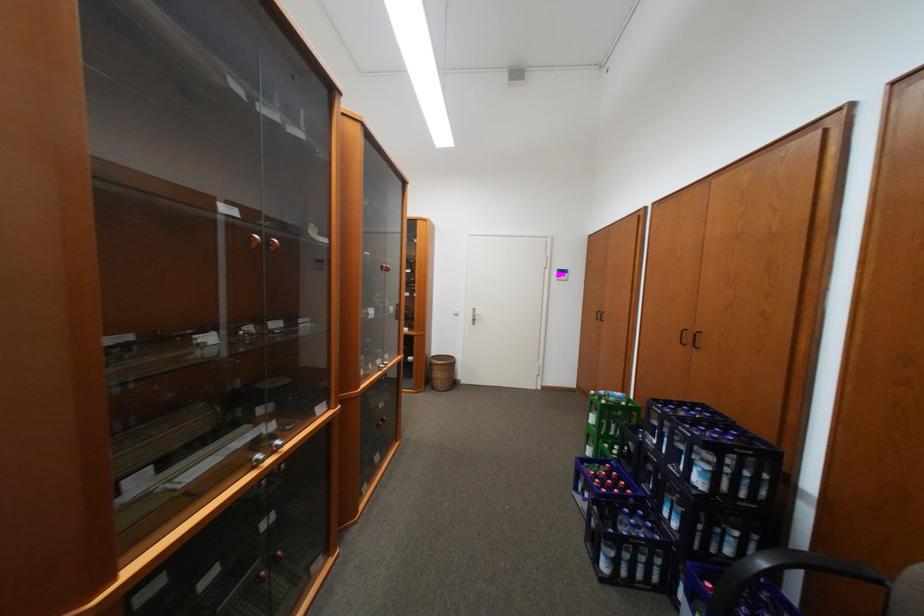
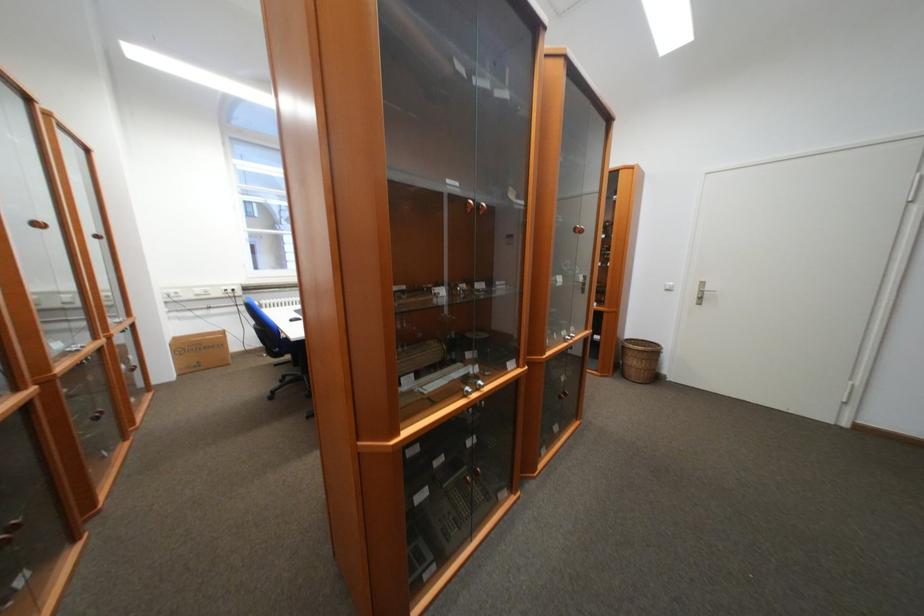
Locate, in the second image, the point that corresponds to point (445, 362) in the first image.

(640, 347)